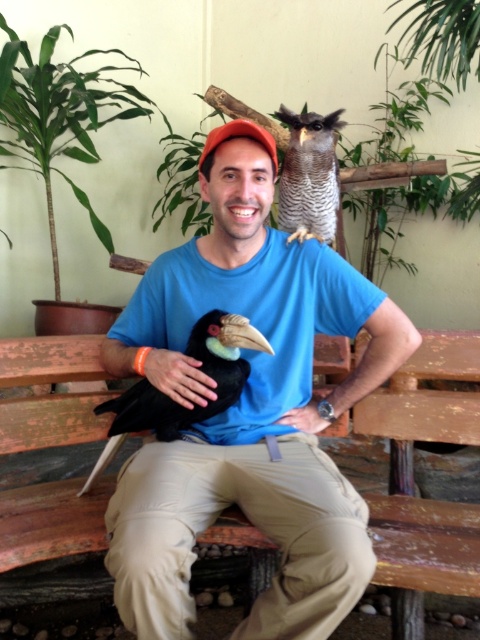
Describe the element at coordinates (360, 324) in the screenshot. I see `blue fabric shirt at center` at that location.

Can you confirm if blue fabric shirt at center is bigger than matte black hand at center?

Correct, blue fabric shirt at center is larger in size than matte black hand at center.

Does point (322, 300) come closer to viewer compared to point (184, 397)?

No.

You are a GUI agent. You are given a task and a screenshot of the screen. Output one action in this format:
    pyautogui.click(x=<x>, y=<y>)
    Task: Click on the blue fabric shirt at center
    This screenshot has width=480, height=640.
    Given the screenshot: What is the action you would take?
    pyautogui.click(x=360, y=324)

Who is positioned more to the left, blue fabric shirt at center or matte blue shirt at center?

From the viewer's perspective, matte blue shirt at center appears more on the left side.

Locate an element on the screen. The image size is (480, 640). blue fabric shirt at center is located at coordinates (360, 324).

This screenshot has width=480, height=640. I want to click on blue fabric shirt at center, so click(360, 324).

Can you confirm if blue fabric shirt at center is wider than black matte hornbill at lower left?

In fact, blue fabric shirt at center might be narrower than black matte hornbill at lower left.

Does blue fabric shirt at center appear over black matte hornbill at lower left?

Yes.

Which is behind, point (362, 305) or point (227, 323)?

The point (362, 305) is more distant.

The image size is (480, 640). Identify the location of blue fabric shirt at center. (360, 324).